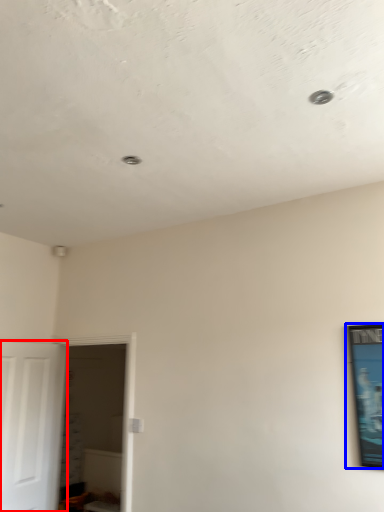
Question: Which point is further to the camera, door (highlighted by a red box) or picture frame (highlighted by a blue box)?

Choices:
 (A) door
 (B) picture frame

Answer: (A)